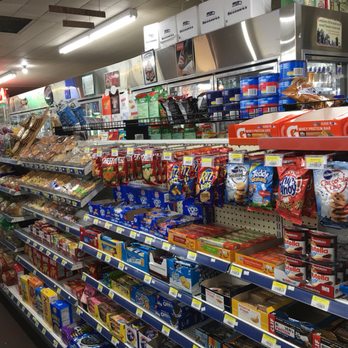
Identify the location of shelve racks. (214, 264), (209, 311), (175, 336).